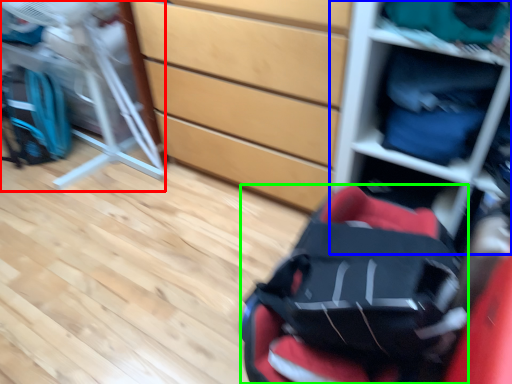
Question: Considering the real-world distances, which object is closest to folding chair (highlighted by a red box)? shelf (highlighted by a blue box) or baby carriage (highlighted by a green box).

Choices:
 (A) shelf
 (B) baby carriage

Answer: (A)